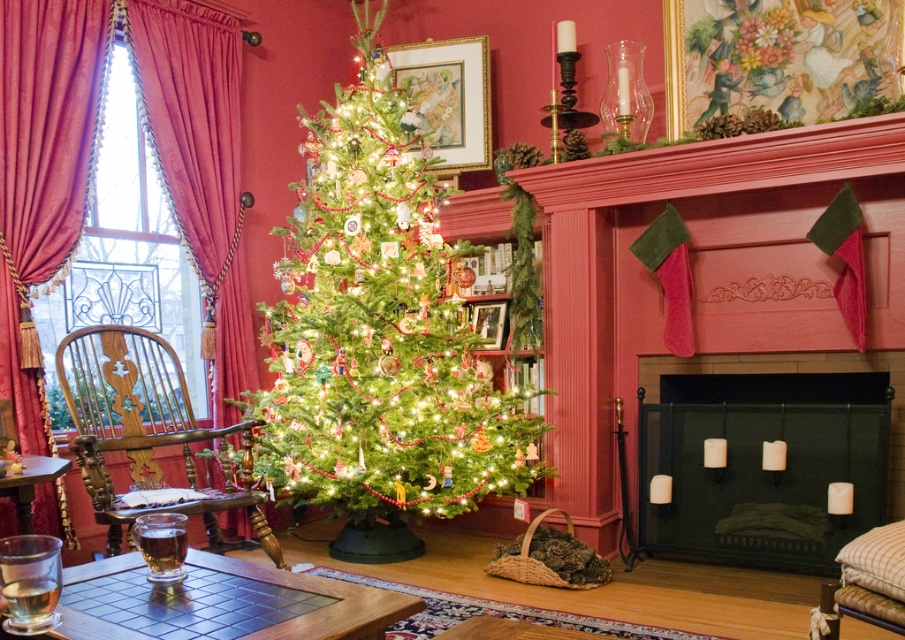
Question: Observing the image, what is the correct spatial positioning of green matte christmas tree at center in reference to black metal fireplace at center?

Choices:
 (A) below
 (B) above

Answer: (B)

Question: Can you confirm if green matte christmas tree at center is positioned to the right of velvet drapery at left?

Choices:
 (A) no
 (B) yes

Answer: (B)

Question: Among these objects, which one is nearest to the camera?

Choices:
 (A) velvet curtain at left
 (B) velvet drapery at left

Answer: (A)

Question: Which of the following is the farthest from the observer?

Choices:
 (A) (859, 490)
 (B) (138, 388)

Answer: (B)

Question: Is black metal fireplace at center smaller than velvet curtain at left?

Choices:
 (A) yes
 (B) no

Answer: (B)

Question: Considering the real-world distances, which object is farthest from the velvet drapery at left?

Choices:
 (A) woodenwoodenarmchair at left
 (B) green matte christmas tree at center
 (C) black metal fireplace at center

Answer: (C)